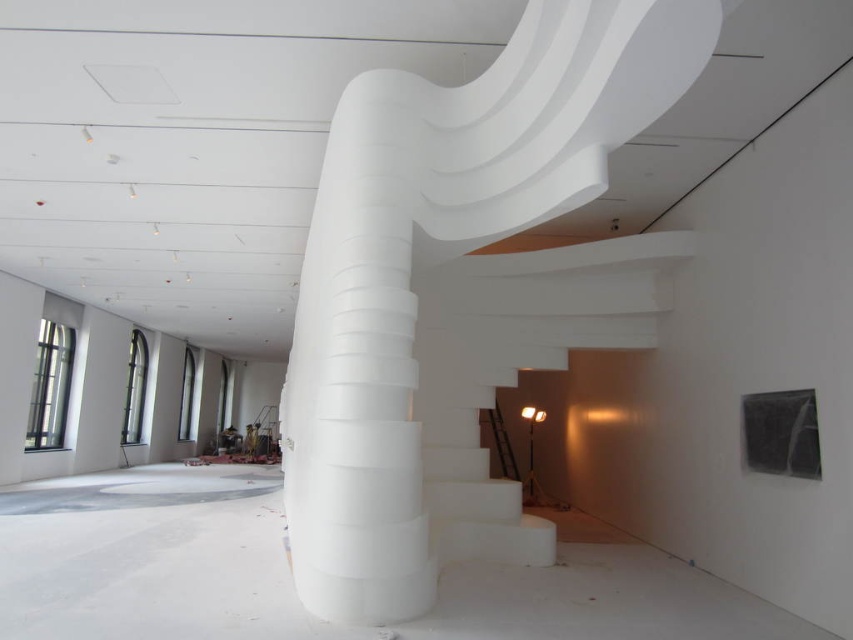
Who is higher up, white matte staircase at center or white matte stairs at center?

Positioned higher is white matte staircase at center.

Which of these two, white matte staircase at center or white matte stairs at center, stands shorter?

With less height is white matte stairs at center.

Describe the element at coordinates (462, 291) in the screenshot. I see `white matte staircase at center` at that location.

Locate an element on the screen. white matte staircase at center is located at coordinates (462, 291).